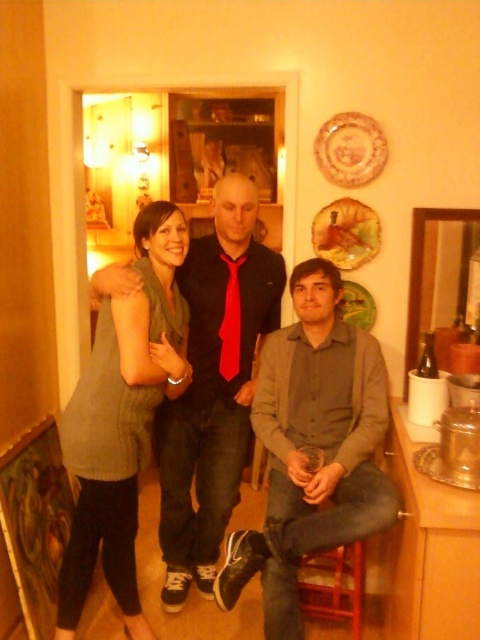
You are a photographer adjusting your camera settings to focus on the matte gray shirt at center and the red satin tie at center. Which object should you focus on first to ensure both are in sharp focus?

The matte gray shirt at center is closer to the viewer than the red satin tie at center, so focus on the matte gray shirt at center first to ensure both are in sharp focus.

You are a photographer adjusting the lighting for a group photo. You need to ensure that both the green knit sweater at left and the red satin tie at center are well lit. Given their distance apart, will you need to adjust the lighting setup to accommodate both objects simultaneously?

The green knit sweater at left is 16.69 inches away from the red satin tie at center. Since they are only about 1.4 feet apart, the lighting setup can likely cover both objects without needing major adjustments, as the distance is relatively small.

You are a tailor measuring the distance between the matte gray shirt at center and the red satin tie at center for a custom fit. The minimum required space for proper adjustment is 16 inches. Can the current distance accommodate this requirement?

The matte gray shirt at center is 16.59 inches from the red satin tie at center, which exceeds the minimum required space of 16 inches. Therefore, the current distance can accommodate the requirement for proper adjustment.